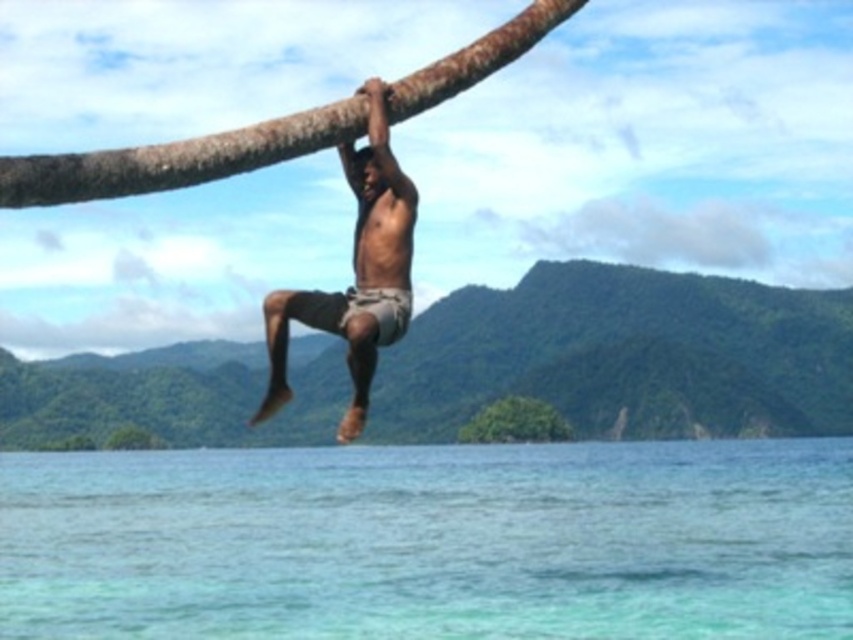
Question: Is brown textured shorts at center behind green leafy tree at center?

Choices:
 (A) yes
 (B) no

Answer: (B)

Question: Is clear blue water at lower center positioned behind brown textured shorts at center?

Choices:
 (A) yes
 (B) no

Answer: (A)

Question: Which point appears farthest from the camera in this image?

Choices:
 (A) (310, 538)
 (B) (518, 438)
 (C) (361, 241)

Answer: (B)

Question: Does brown textured shorts at center lie in front of green leafy tree at center?

Choices:
 (A) no
 (B) yes

Answer: (B)

Question: Which point is farther from the camera taking this photo?

Choices:
 (A) (511, 404)
 (B) (412, 234)
 (C) (113, 484)

Answer: (A)

Question: Which object is the farthest from the brown textured shorts at center?

Choices:
 (A) clear blue water at lower center
 (B) green leafy tree at center

Answer: (B)